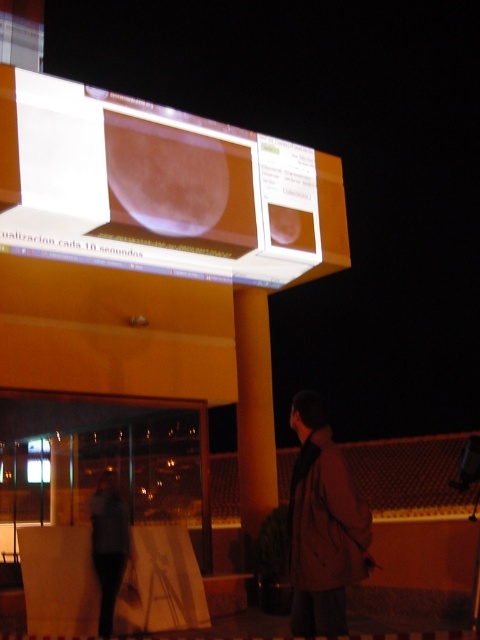
Does point (63, 202) lie behind point (115, 541)?

Yes.

Where is `matte glass screen at upper center`? matte glass screen at upper center is located at coordinates (149, 186).

Does point (95, 93) come in front of point (108, 518)?

No, it is not.

This screenshot has height=640, width=480. Identify the location of matte glass screen at upper center. (149, 186).

Is point (171, 134) positioned behind point (343, 474)?

Yes, it is.

Which of these two, matte glass screen at upper center or brown leather jacket at lower right, stands shorter?

brown leather jacket at lower right

Measure the distance between matte glass screen at upper center and camera.

matte glass screen at upper center is 25.47 feet away from camera.

The image size is (480, 640). What are the coordinates of `matte glass screen at upper center` in the screenshot? It's located at (149, 186).

Who is lower down, brown leather jacket at lower right or dark gray fabric jacket at lower left?

dark gray fabric jacket at lower left is lower down.

Is brown leather jacket at lower right positioned at the back of dark gray fabric jacket at lower left?

No, brown leather jacket at lower right is in front of dark gray fabric jacket at lower left.

Between point (336, 460) and point (120, 545), which one is positioned in front?

Point (336, 460) is more forward.

Locate an element on the screen. This screenshot has height=640, width=480. brown leather jacket at lower right is located at coordinates point(323,525).